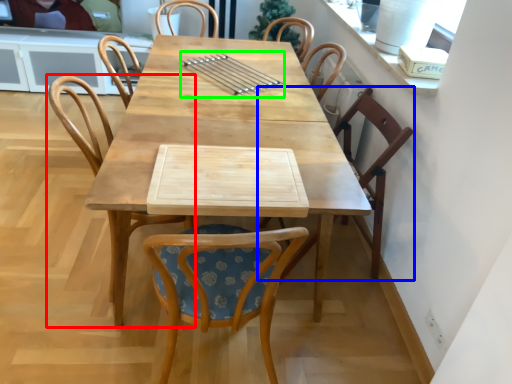
Question: Estimate the real-world distances between objects in this image. Which object is closer to chair (highlighted by a red box), chair (highlighted by a blue box) or tableware (highlighted by a green box)?

Choices:
 (A) chair
 (B) tableware

Answer: (B)